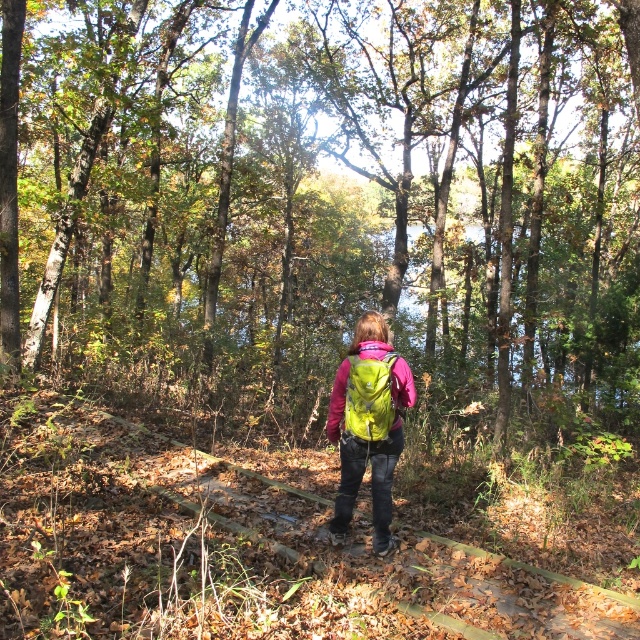
Question: Which object is positioned farthest from the neon green backpack at center?

Choices:
 (A) green matte backpack at center
 (B) matte green backpack at center

Answer: (A)

Question: Does green matte backpack at center appear on the left side of neon green backpack at center?

Choices:
 (A) yes
 (B) no

Answer: (B)

Question: Can you confirm if green matte backpack at center is smaller than neon green backpack at center?

Choices:
 (A) no
 (B) yes

Answer: (A)

Question: Which point is closer to the camera?

Choices:
 (A) matte green backpack at center
 (B) neon green backpack at center
 (C) green matte backpack at center

Answer: (B)

Question: Which point appears closest to the camera in this image?

Choices:
 (A) (358, 461)
 (B) (429, 272)

Answer: (A)

Question: Is neon green backpack at center further to camera compared to matte green backpack at center?

Choices:
 (A) yes
 (B) no

Answer: (B)